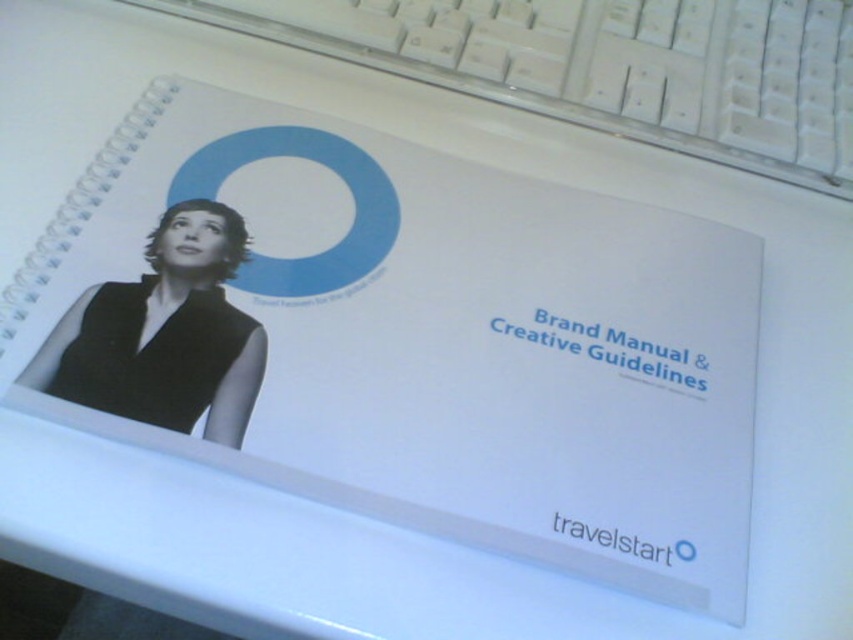
Question: Among these objects, which one is nearest to the camera?

Choices:
 (A) white plastic keyboard at upper center
 (B) black matte/vinyl photo at left

Answer: (B)

Question: Does white plastic keyboard at upper center have a smaller size compared to black matte/vinyl photo at left?

Choices:
 (A) yes
 (B) no

Answer: (B)

Question: Considering the relative positions of white plastic keyboard at upper center and black matte/vinyl photo at left in the image provided, where is white plastic keyboard at upper center located with respect to black matte/vinyl photo at left?

Choices:
 (A) below
 (B) above

Answer: (B)

Question: Is white plastic keyboard at upper center below black matte/vinyl photo at left?

Choices:
 (A) no
 (B) yes

Answer: (A)